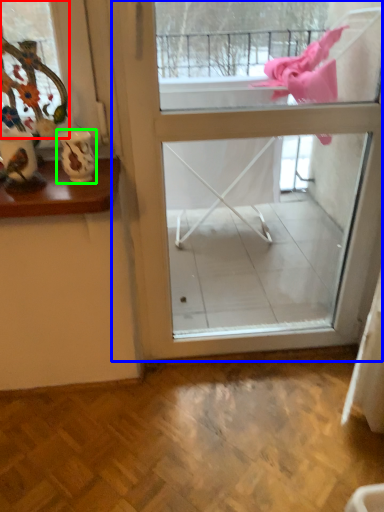
Question: Estimate the real-world distances between objects in this image. Which object is closer to window (highlighted by a red box), screen door (highlighted by a blue box) or vase (highlighted by a green box)?

Choices:
 (A) screen door
 (B) vase

Answer: (B)